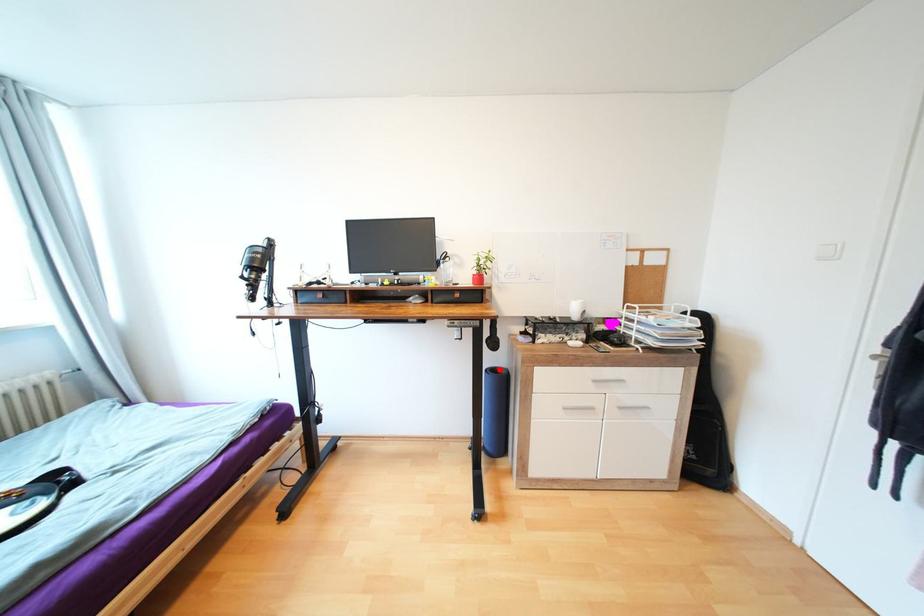
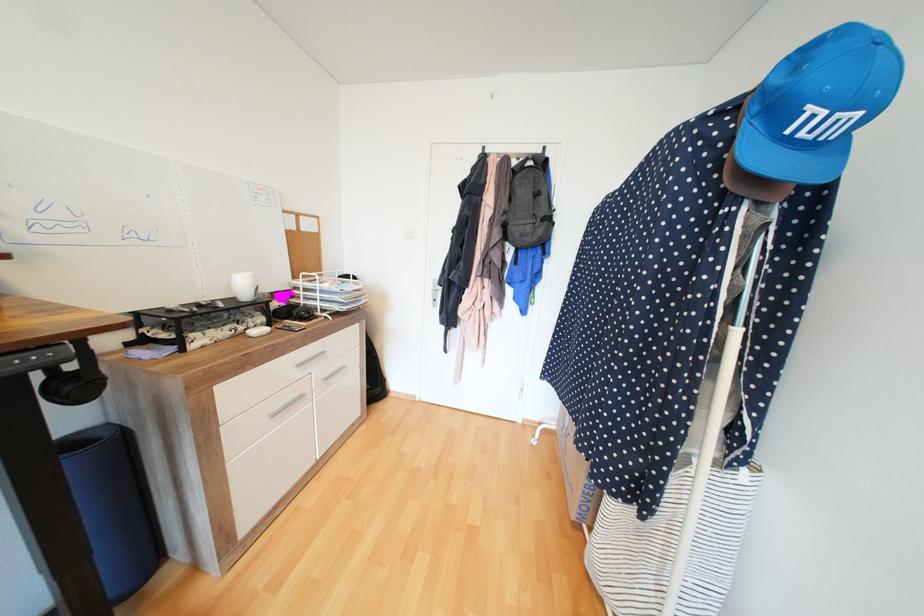
The point at the highlighted location is marked in the first image. Where is the corresponding point in the second image?

(80, 443)